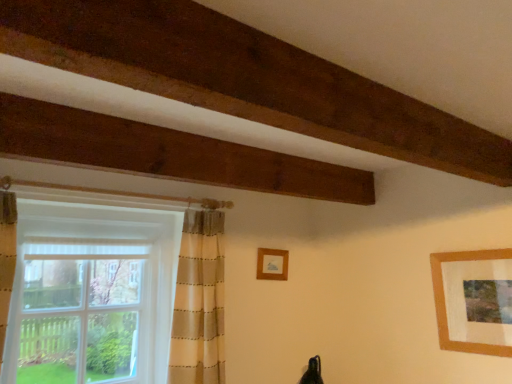
Question: From the image's perspective, is wooden frame at center, which ranks as the 2th picture frame in front-to-back order, under wooden picture frame at upper right, which appears as the first picture frame when viewed from the right?

Choices:
 (A) no
 (B) yes

Answer: (A)

Question: Is the position of wooden frame at center, which is counted as the 2th picture frame, starting from the right, less distant than that of wooden picture frame at upper right, which is the first picture frame from front to back?

Choices:
 (A) no
 (B) yes

Answer: (A)

Question: Is wooden frame at center, which ranks as the 2th picture frame in front-to-back order, aimed at wooden picture frame at upper right, the 2th picture frame when ordered from left to right?

Choices:
 (A) yes
 (B) no

Answer: (A)

Question: Can you see wooden frame at center, positioned as the 1th picture frame in back-to-front order, touching wooden picture frame at upper right, the 2th picture frame when ordered from left to right?

Choices:
 (A) yes
 (B) no

Answer: (B)

Question: Is the position of wooden frame at center, positioned as the 1th picture frame in back-to-front order, more distant than that of wooden picture frame at upper right, which is the first picture frame from front to back?

Choices:
 (A) yes
 (B) no

Answer: (A)

Question: Is wooden picture frame at upper right, the 2th picture frame when ordered from left to right, at the back of wooden frame at center, positioned as the 1th picture frame in back-to-front order?

Choices:
 (A) yes
 (B) no

Answer: (B)

Question: Is white sheer curtain at left positioned behind wooden picture frame at upper right, which is the 2th picture frame in back-to-front order?

Choices:
 (A) no
 (B) yes

Answer: (A)

Question: Is wooden picture frame at upper right, which appears as the first picture frame when viewed from the right, completely or partially inside white sheer curtain at left?

Choices:
 (A) no
 (B) yes

Answer: (A)

Question: Is white sheer curtain at left not within wooden picture frame at upper right, which is the first picture frame from front to back?

Choices:
 (A) no
 (B) yes

Answer: (B)

Question: Can you confirm if white sheer curtain at left is thinner than wooden picture frame at upper right, which is the 2th picture frame in back-to-front order?

Choices:
 (A) no
 (B) yes

Answer: (A)

Question: Is white sheer curtain at left positioned with its back to wooden picture frame at upper right, which is the 2th picture frame in back-to-front order?

Choices:
 (A) yes
 (B) no

Answer: (B)

Question: Is white sheer curtain at left touching wooden picture frame at upper right, which is the first picture frame from front to back?

Choices:
 (A) yes
 (B) no

Answer: (B)

Question: Is white sheer curtain at left not inside wooden frame at center, which ranks as the 2th picture frame in front-to-back order?

Choices:
 (A) yes
 (B) no

Answer: (A)